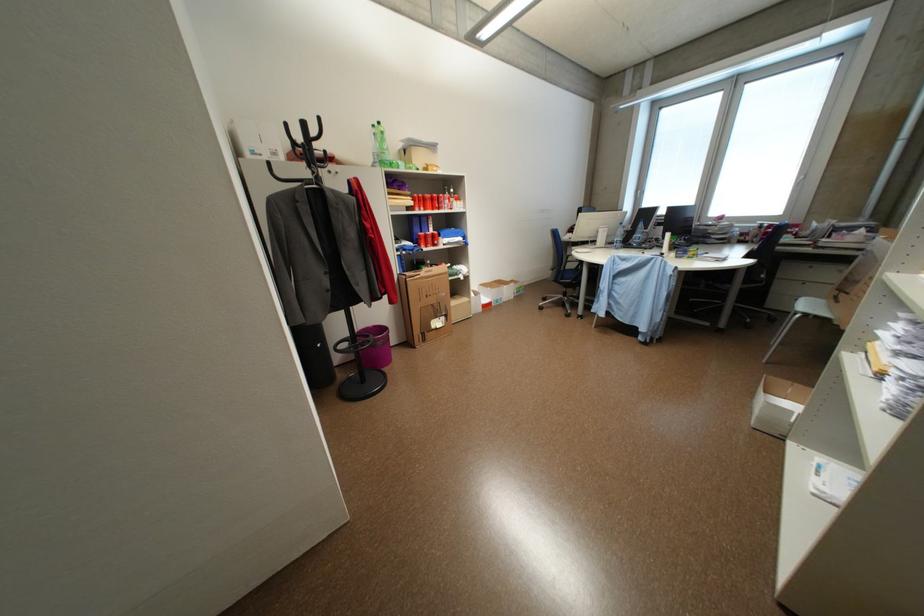
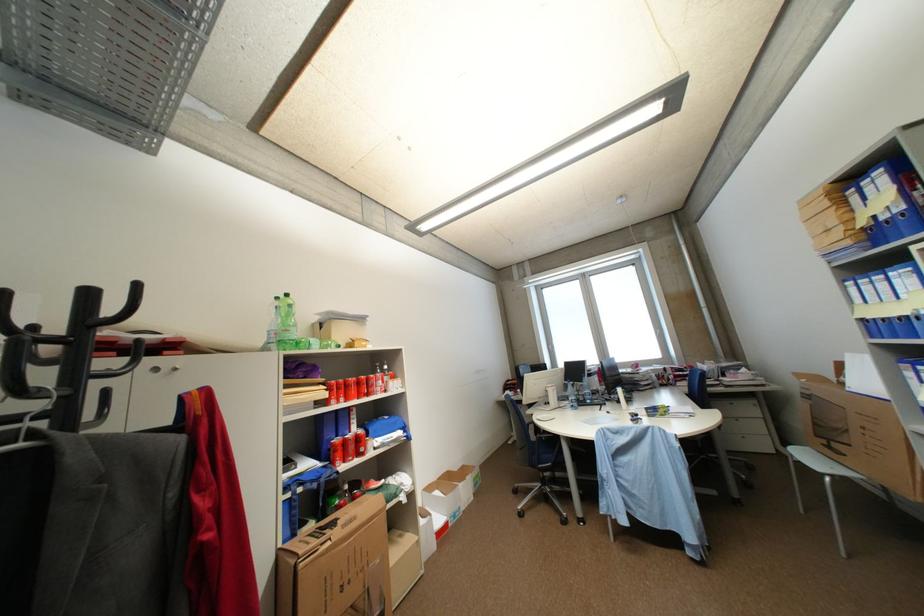
Where in the second image is the point corresponding to point (423, 238) from the first image?

(333, 448)